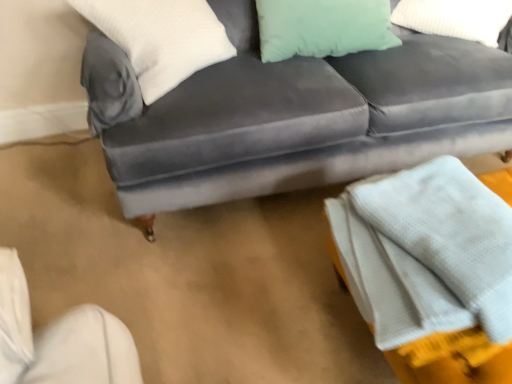
What do you see at coordinates (292, 116) in the screenshot?
I see `velvet gray couch at center` at bounding box center [292, 116].

What do you see at coordinates (455, 18) in the screenshot? I see `mint green fabric pillow at upper right, arranged as the 1th pillow when viewed from the right` at bounding box center [455, 18].

This screenshot has width=512, height=384. What do you see at coordinates (161, 38) in the screenshot? I see `white soft pillow at upper left, which is the 1th pillow from left to right` at bounding box center [161, 38].

Image resolution: width=512 pixels, height=384 pixels. I want to click on velvet gray couch at center, so click(x=292, y=116).

Is white textured blanket at lower right bigger than velvet gray couch at center?

No.

Considering the positions of objects white textured blanket at lower right and velvet gray couch at center in the image provided, who is behind, white textured blanket at lower right or velvet gray couch at center?

velvet gray couch at center.

Can you tell me how much white textured blanket at lower right and velvet gray couch at center differ in facing direction?

The angle between the facing direction of white textured blanket at lower right and the facing direction of velvet gray couch at center is 88 degrees.

The image size is (512, 384). What are the coordinates of `studio couch positioned vertically above the white textured blanket at lower right (from a real-world perspective)` in the screenshot? It's located at (292, 116).

Is white soft pillow at upper left, which is the 1th pillow from left to right, facing towards mint green fabric pillow at upper right, arranged as the 1th pillow when viewed from the right?

No, white soft pillow at upper left, which is the 1th pillow from left to right, is not turned towards mint green fabric pillow at upper right, arranged as the 1th pillow when viewed from the right.

Consider the image. Is white soft pillow at upper left, which is the 2th pillow in right-to-left order, at the right side of mint green fabric pillow at upper right, positioned as the 2th pillow in left-to-right order?

No, white soft pillow at upper left, which is the 2th pillow in right-to-left order, is not to the right of mint green fabric pillow at upper right, positioned as the 2th pillow in left-to-right order.

From the image's perspective, would you say white soft pillow at upper left, which is the 2th pillow in right-to-left order, is shown under mint green fabric pillow at upper right, positioned as the 2th pillow in left-to-right order?

Yes, from the image's perspective, white soft pillow at upper left, which is the 2th pillow in right-to-left order, is beneath mint green fabric pillow at upper right, positioned as the 2th pillow in left-to-right order.

How different are the orientations of white soft pillow at upper left, which is the 1th pillow from left to right, and velvet gray couch at center in degrees?

The facing directions of white soft pillow at upper left, which is the 1th pillow from left to right, and velvet gray couch at center are 37.4 degrees apart.

Is white soft pillow at upper left, which is the 1th pillow from left to right, aimed at velvet gray couch at center?

Yes, white soft pillow at upper left, which is the 1th pillow from left to right, faces towards velvet gray couch at center.

Does point (131, 43) lie behind point (326, 142)?

No, it is not.

Can we say white soft pillow at upper left, which is the 2th pillow in right-to-left order, lies outside velvet gray couch at center?

No.

Is mint green fabric pillow at upper right, arranged as the 1th pillow when viewed from the right, facing towards velvet gray couch at center?

Yes, mint green fabric pillow at upper right, arranged as the 1th pillow when viewed from the right, is aimed at velvet gray couch at center.

Can you confirm if mint green fabric pillow at upper right, positioned as the 2th pillow in left-to-right order, is thinner than velvet gray couch at center?

Yes.

Can you see mint green fabric pillow at upper right, arranged as the 1th pillow when viewed from the right, touching velvet gray couch at center?

No, mint green fabric pillow at upper right, arranged as the 1th pillow when viewed from the right, is not with velvet gray couch at center.

From the image's perspective, does mint green fabric pillow at upper right, arranged as the 1th pillow when viewed from the right, appear higher than velvet gray couch at center?

Yes, from the image's perspective, mint green fabric pillow at upper right, arranged as the 1th pillow when viewed from the right, is on top of velvet gray couch at center.

Is velvet gray couch at center positioned before mint green fabric pillow at upper right, arranged as the 1th pillow when viewed from the right?

Yes, it is.

Can you confirm if velvet gray couch at center is bigger than mint green fabric pillow at upper right, arranged as the 1th pillow when viewed from the right?

Yes.

Is velvet gray couch at center oriented towards mint green fabric pillow at upper right, arranged as the 1th pillow when viewed from the right?

No, velvet gray couch at center is not facing towards mint green fabric pillow at upper right, arranged as the 1th pillow when viewed from the right.

How different are the orientations of white textured blanket at lower right and white soft pillow at upper left, which is the 1th pillow from left to right, in degrees?

There is a 50.6-degree angle between the facing directions of white textured blanket at lower right and white soft pillow at upper left, which is the 1th pillow from left to right.

Is white textured blanket at lower right placed right next to white soft pillow at upper left, which is the 2th pillow in right-to-left order?

There is a gap between white textured blanket at lower right and white soft pillow at upper left, which is the 2th pillow in right-to-left order.

Does point (362, 195) lie behind point (151, 31)?

No, it is not.

Which object is wider, white textured blanket at lower right or white soft pillow at upper left, which is the 1th pillow from left to right?

Wider between the two is white textured blanket at lower right.

Does point (405, 75) appear closer or farther from the camera than point (153, 45)?

Point (405, 75).

Is velvet gray couch at center in front of or behind white soft pillow at upper left, which is the 1th pillow from left to right, in the image?

Visually, velvet gray couch at center is located in front of white soft pillow at upper left, which is the 1th pillow from left to right.

Between velvet gray couch at center and white soft pillow at upper left, which is the 2th pillow in right-to-left order, which one has larger width?

velvet gray couch at center is wider.

From the image's perspective, which one is positioned higher, velvet gray couch at center or white soft pillow at upper left, which is the 2th pillow in right-to-left order?

white soft pillow at upper left, which is the 2th pillow in right-to-left order, appears higher in the image.

Locate an element on the screen. This screenshot has height=384, width=512. studio couch located above the white textured blanket at lower right (from the image's perspective) is located at coordinates (292, 116).

Find the location of `pillow that is below the mint green fabric pillow at upper right, positioned as the 2th pillow in left-to-right order (from the image's perspective)`. pillow that is below the mint green fabric pillow at upper right, positioned as the 2th pillow in left-to-right order (from the image's perspective) is located at coordinates (161, 38).

Considering their positions, is white textured blanket at lower right positioned further to mint green fabric pillow at upper right, positioned as the 2th pillow in left-to-right order, than velvet gray couch at center?

Among the two, white textured blanket at lower right is located further to mint green fabric pillow at upper right, positioned as the 2th pillow in left-to-right order.

Considering their positions, is white soft pillow at upper left, which is the 2th pillow in right-to-left order, positioned further to mint green fabric pillow at upper right, positioned as the 2th pillow in left-to-right order, than velvet gray couch at center?

The object further to mint green fabric pillow at upper right, positioned as the 2th pillow in left-to-right order, is white soft pillow at upper left, which is the 2th pillow in right-to-left order.

Estimate the real-world distances between objects in this image. Which object is closer to white textured blanket at lower right, white soft pillow at upper left, which is the 2th pillow in right-to-left order, or velvet gray couch at center?

velvet gray couch at center is closer to white textured blanket at lower right.

Considering their positions, is velvet gray couch at center positioned closer to white textured blanket at lower right than white soft pillow at upper left, which is the 1th pillow from left to right?

velvet gray couch at center is closer to white textured blanket at lower right.

When comparing their distances from white soft pillow at upper left, which is the 1th pillow from left to right, does velvet gray couch at center or white textured blanket at lower right seem further?

Based on the image, white textured blanket at lower right appears to be further to white soft pillow at upper left, which is the 1th pillow from left to right.

From the image, which object appears to be farther from white textured blanket at lower right, white soft pillow at upper left, which is the 1th pillow from left to right, or mint green fabric pillow at upper right, arranged as the 1th pillow when viewed from the right?

Among the two, mint green fabric pillow at upper right, arranged as the 1th pillow when viewed from the right, is located further to white textured blanket at lower right.

When comparing their distances from velvet gray couch at center, does white soft pillow at upper left, which is the 2th pillow in right-to-left order, or mint green fabric pillow at upper right, positioned as the 2th pillow in left-to-right order, seem closer?

Based on the image, white soft pillow at upper left, which is the 2th pillow in right-to-left order, appears to be nearer to velvet gray couch at center.

Looking at the image, which one is located closer to mint green fabric pillow at upper right, arranged as the 1th pillow when viewed from the right, white textured blanket at lower right or white soft pillow at upper left, which is the 1th pillow from left to right?

Among the two, white soft pillow at upper left, which is the 1th pillow from left to right, is located nearer to mint green fabric pillow at upper right, arranged as the 1th pillow when viewed from the right.

Where is `blanket located between white soft pillow at upper left, which is the 1th pillow from left to right, and mint green fabric pillow at upper right, positioned as the 2th pillow in left-to-right order, in the left-right direction`? This screenshot has width=512, height=384. blanket located between white soft pillow at upper left, which is the 1th pillow from left to right, and mint green fabric pillow at upper right, positioned as the 2th pillow in left-to-right order, in the left-right direction is located at coordinates (449, 233).

Identify the location of studio couch between white soft pillow at upper left, which is the 1th pillow from left to right, and mint green fabric pillow at upper right, positioned as the 2th pillow in left-to-right order, from left to right. (292, 116).

Locate an element on the screen. studio couch between mint green fabric pillow at upper right, arranged as the 1th pillow when viewed from the right, and white textured blanket at lower right, in the vertical direction is located at coordinates (292, 116).

You are a GUI agent. You are given a task and a screenshot of the screen. Output one action in this format:
    pyautogui.click(x=<x>, y=<y>)
    Task: Click on the studio couch between white soft pillow at upper left, which is the 1th pillow from left to right, and white textured blanket at lower right
    The image size is (512, 384).
    Given the screenshot: What is the action you would take?
    pyautogui.click(x=292, y=116)